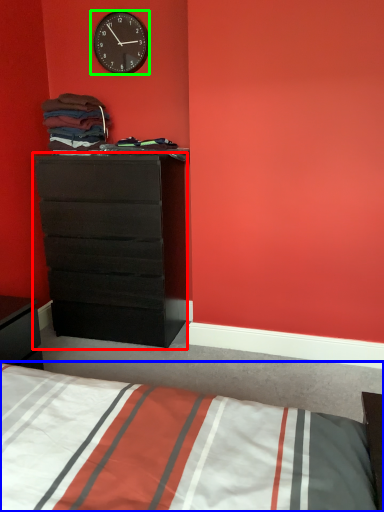
Question: Estimate the real-world distances between objects in this image. Which object is closer to chest of drawers (highlighted by a red box), bed (highlighted by a blue box) or wall clock (highlighted by a green box)?

Choices:
 (A) bed
 (B) wall clock

Answer: (B)